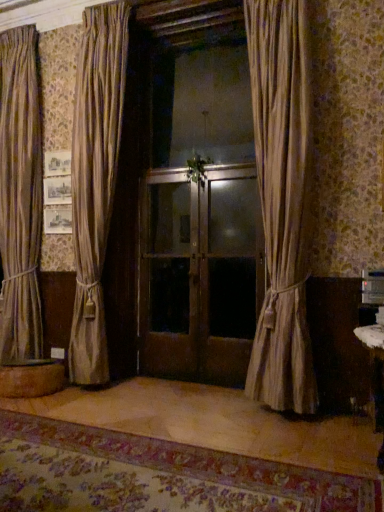
Where is `vacant area that lies between silky beige curtain at center, positioned as the 1th curtain in front-to-back order, and wooden round table at lower left`? The height and width of the screenshot is (512, 384). vacant area that lies between silky beige curtain at center, positioned as the 1th curtain in front-to-back order, and wooden round table at lower left is located at coordinates (169, 401).